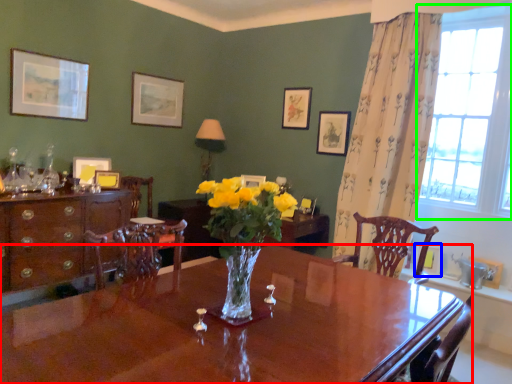
Question: Which is farther away from desk (highlighted by a red box)? picture frame (highlighted by a blue box) or window (highlighted by a green box)?

Choices:
 (A) picture frame
 (B) window

Answer: (B)